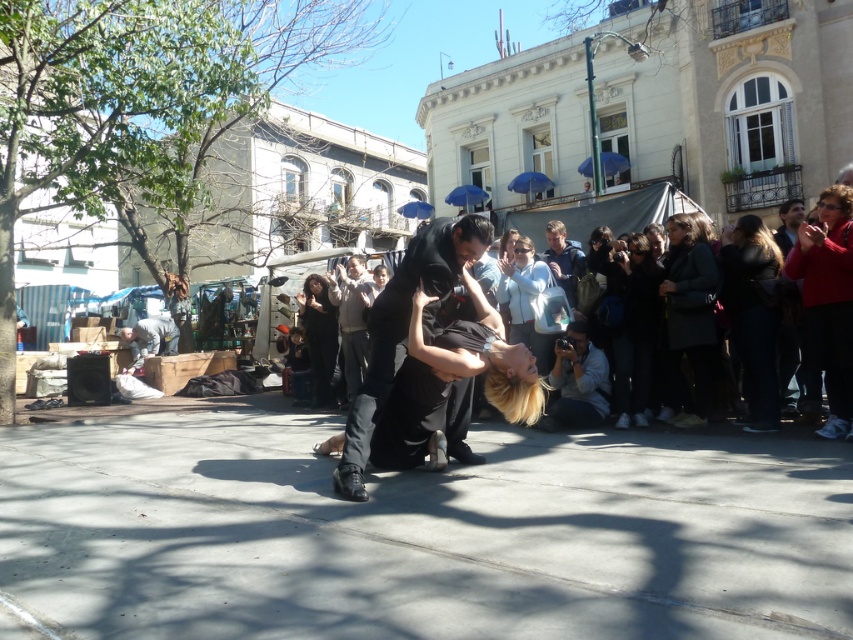
Question: Where is red sweater at right located in relation to matte black dress at center in the image?

Choices:
 (A) left
 (B) right

Answer: (B)

Question: Which of these objects is positioned farthest from the matte black dress at center?

Choices:
 (A) dark brown leather jacket at right
 (B) light brown leather jacket at upper center
 (C) gray fabric camera at lower right
 (D) dark gray coat at right

Answer: (A)

Question: Is the position of black fabric jacket at center more distant than that of light brown leather jacket at upper center?

Choices:
 (A) yes
 (B) no

Answer: (B)

Question: Which object is closer to the camera taking this photo?

Choices:
 (A) black fabric jacket at center
 (B) gray fabric camera at lower right

Answer: (B)

Question: Which of the following is the farthest from the observer?

Choices:
 (A) red sweater at right
 (B) black fabric jacket at center

Answer: (B)

Question: Can you confirm if dark gray coat at right is positioned below gray fabric camera at lower right?

Choices:
 (A) no
 (B) yes

Answer: (A)